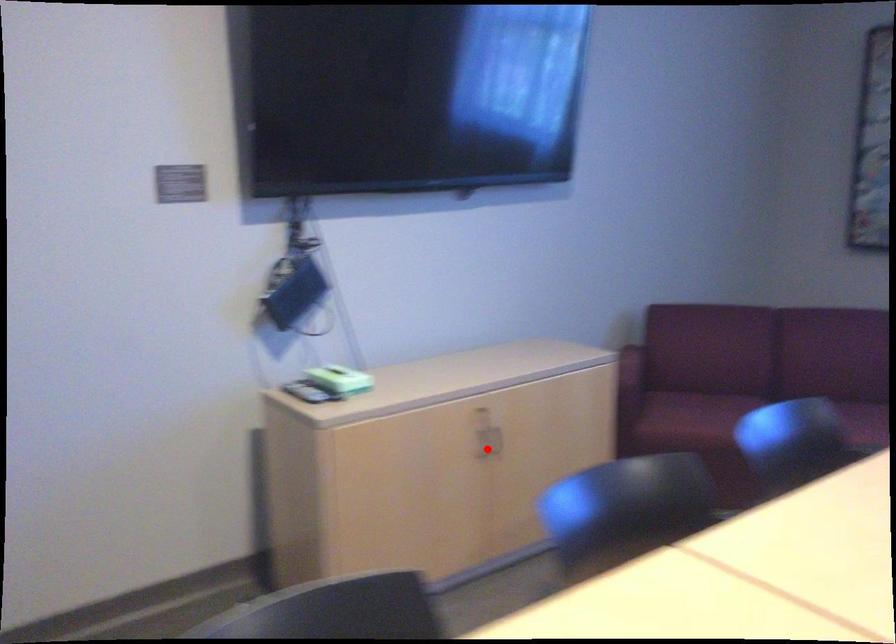
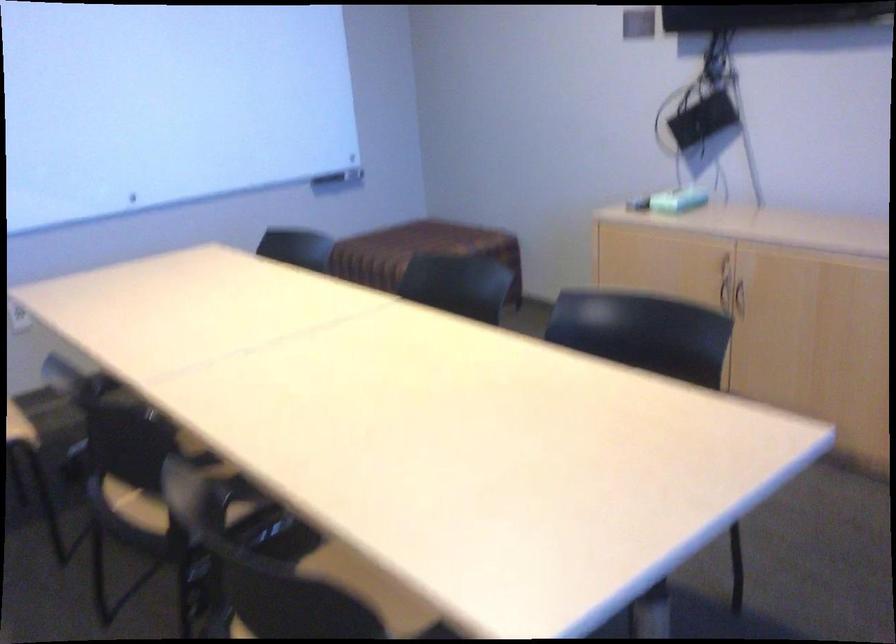
Find the pixel in the second image that matches the highlighted location in the first image.

(738, 299)